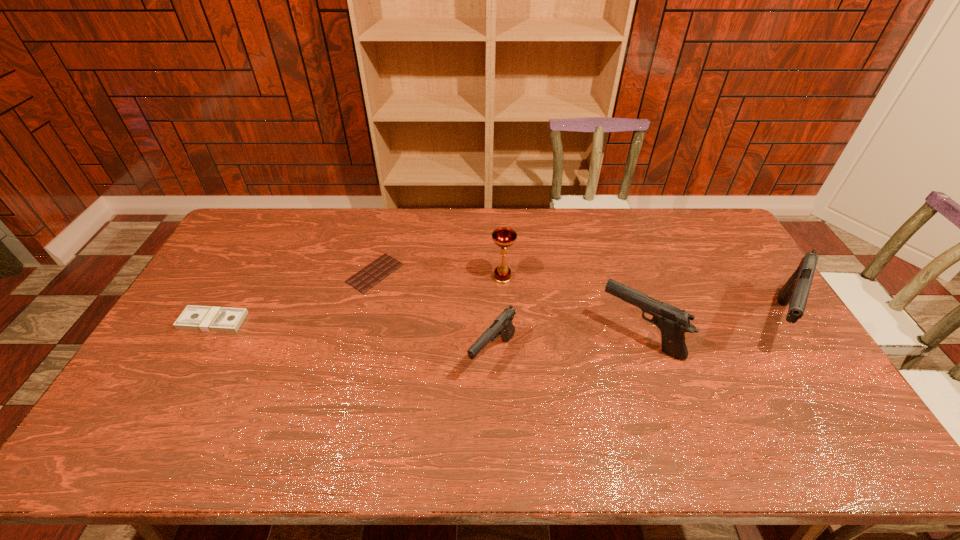
Where is `the fourth tallest object`? Image resolution: width=960 pixels, height=540 pixels. the fourth tallest object is located at coordinates (503, 325).

You are a GUI agent. You are given a task and a screenshot of the screen. Output one action in this format:
    pyautogui.click(x=<x>, y=<y>)
    Task: Click on the leftmost gun
    This screenshot has width=960, height=540.
    Given the screenshot: What is the action you would take?
    pyautogui.click(x=503, y=325)

Identify the location of the second gun from right to left. (673, 322).

Where is `the fifth object from left to right`? The height and width of the screenshot is (540, 960). the fifth object from left to right is located at coordinates (673, 322).

Identify the location of the rightmost gun. (795, 292).

This screenshot has height=540, width=960. Identify the location of the rightmost object. (795, 292).

Locate an element on the screen. The image size is (960, 540). dollar is located at coordinates (200, 318).

At what (x,y) coordinates should I click in order to perform the action: click on the fifth tallest object. Please return your answer as a coordinate pair (x, y). Looking at the image, I should click on (200, 318).

What are the coordinates of `the fifth object from right to left` in the screenshot? It's located at (372, 274).

You are a GUI agent. You are given a task and a screenshot of the screen. Output one action in this format:
    pyautogui.click(x=<x>, y=<y>)
    Task: Click on the chocolate bar
    This screenshot has width=960, height=540.
    Given the screenshot: What is the action you would take?
    pyautogui.click(x=372, y=274)